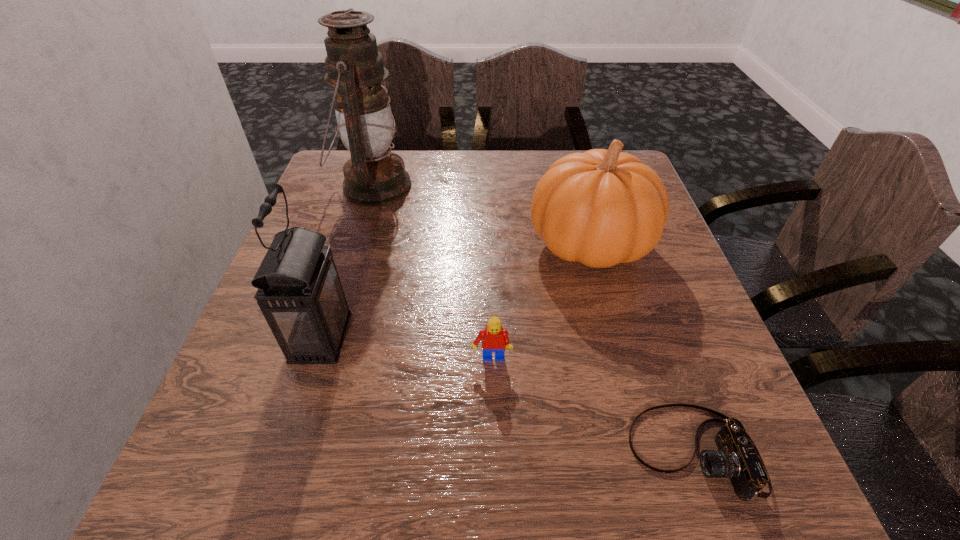
Identify the location of free point located 0.120m on the front-facing side of the third object from right to left. This screenshot has width=960, height=540. (492, 435).

Find the location of a particular element. This screenshot has width=960, height=540. vacant space located on the front-facing side of the camera is located at coordinates (578, 452).

This screenshot has height=540, width=960. Identify the location of vacant space located 0.160m on the front-facing side of the camera. (524, 452).

Where is `free spot located on the front-facing side of the camera`? free spot located on the front-facing side of the camera is located at coordinates (437, 452).

I want to click on object that is at the far edge, so 374,176.

Find the location of `object at the near edge`. object at the near edge is located at coordinates (737, 458).

I want to click on lantern at the left edge, so click(x=374, y=176).

Where is `lantern that is at the left edge`? This screenshot has width=960, height=540. lantern that is at the left edge is located at coordinates (299, 292).

This screenshot has height=540, width=960. I want to click on pumpkin that is at the right edge, so click(600, 208).

Locate an element on the screen. This screenshot has height=540, width=960. camera positioned at the right edge is located at coordinates (737, 458).